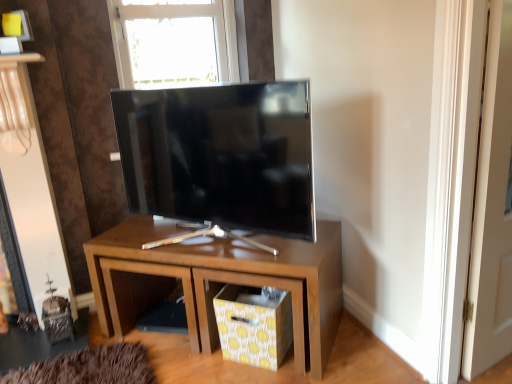
Question: Is yellow dotted fabric drawer at lower center not near matte wood nightstand at center?

Choices:
 (A) yes
 (B) no

Answer: (B)

Question: From a real-world perspective, does yellow dotted fabric drawer at lower center stand above matte wood nightstand at center?

Choices:
 (A) no
 (B) yes

Answer: (A)

Question: Is yellow dotted fabric drawer at lower center next to matte wood nightstand at center?

Choices:
 (A) yes
 (B) no

Answer: (B)

Question: Is yellow dotted fabric drawer at lower center positioned beyond the bounds of matte wood nightstand at center?

Choices:
 (A) no
 (B) yes

Answer: (A)

Question: From a real-world perspective, is yellow dotted fabric drawer at lower center under matte wood nightstand at center?

Choices:
 (A) no
 (B) yes

Answer: (B)

Question: Could you tell me if yellow dotted fabric drawer at lower center is facing matte wood nightstand at center?

Choices:
 (A) no
 (B) yes

Answer: (B)

Question: Is transparent glass window at upper center looking in the opposite direction of matte wood nightstand at center?

Choices:
 (A) no
 (B) yes

Answer: (A)

Question: Is transparent glass window at upper center far away from matte wood nightstand at center?

Choices:
 (A) yes
 (B) no

Answer: (A)

Question: Is transparent glass window at upper center further to the viewer compared to matte wood nightstand at center?

Choices:
 (A) no
 (B) yes

Answer: (B)

Question: Does transparent glass window at upper center have a lesser width compared to matte wood nightstand at center?

Choices:
 (A) no
 (B) yes

Answer: (B)

Question: Is transparent glass window at upper center not inside matte wood nightstand at center?

Choices:
 (A) yes
 (B) no

Answer: (A)

Question: Is transparent glass window at upper center aimed at matte wood nightstand at center?

Choices:
 (A) no
 (B) yes

Answer: (A)

Question: From a real-world perspective, is matte wood nightstand at center physically below yellow dotted fabric drawer at lower center?

Choices:
 (A) no
 (B) yes

Answer: (A)